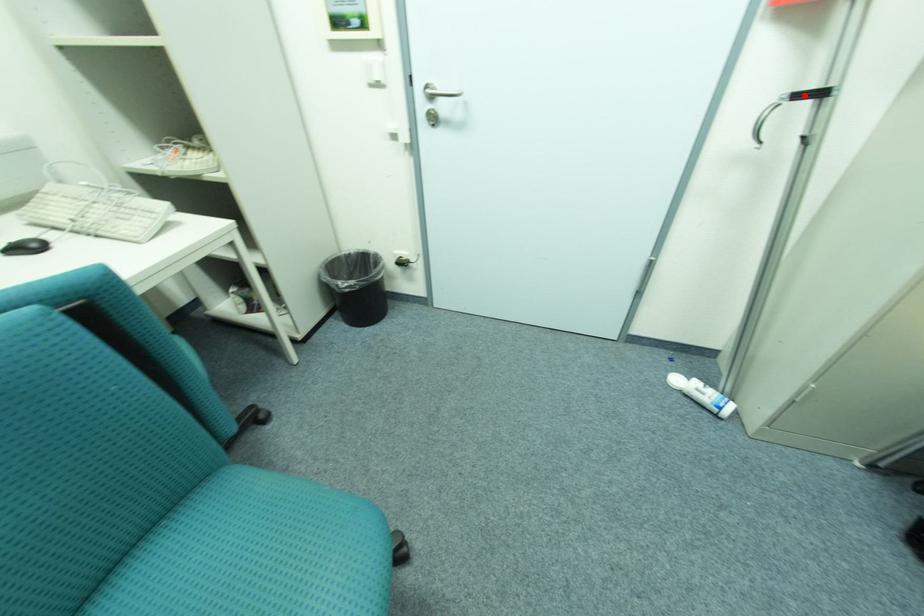
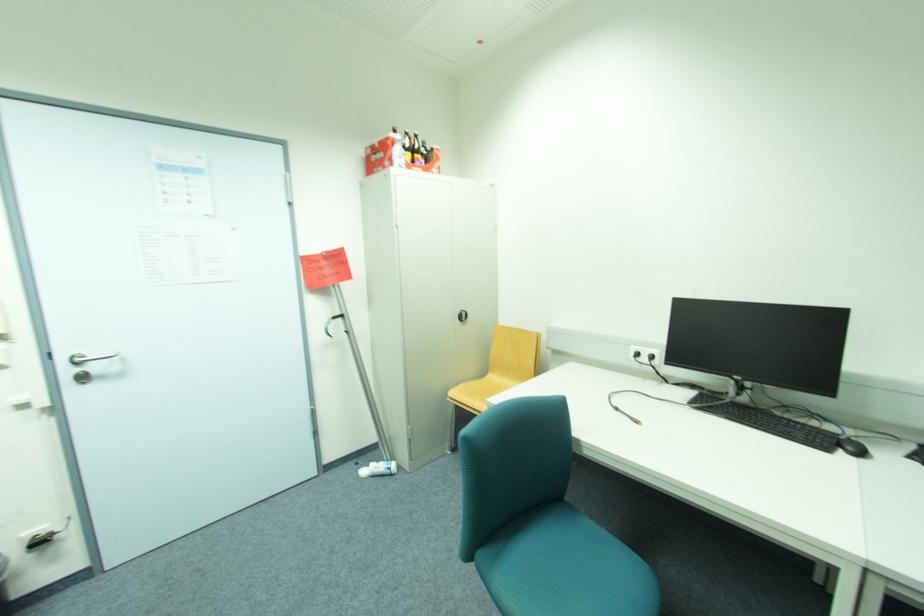
Question: I am providing you with two images of the same scene from different viewpoints. A red point is marked on the first image. Can you still see the location of the red point in image 2?

Choices:
 (A) Yes
 (B) No

Answer: (A)